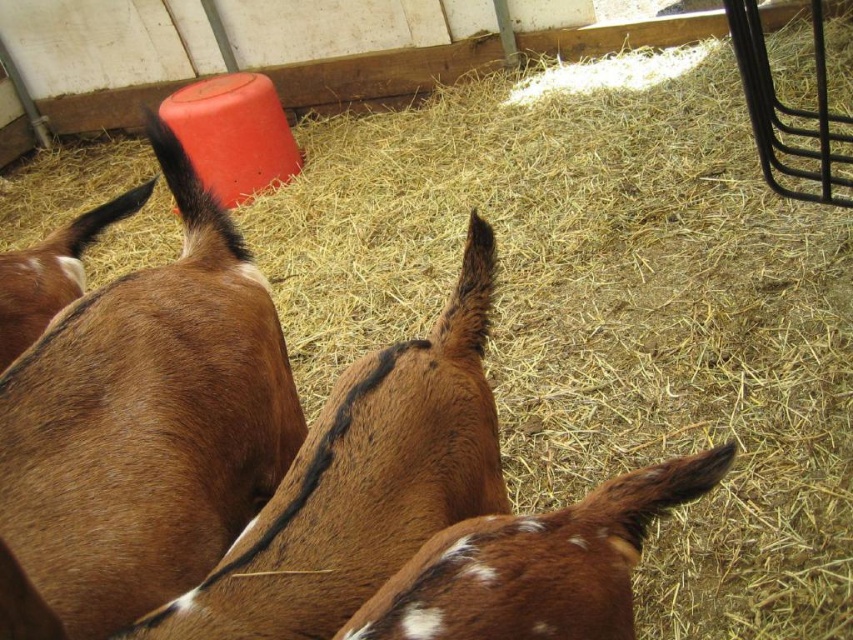
Question: Which point appears farthest from the camera in this image?

Choices:
 (A) (0, 456)
 (B) (25, 289)
 (C) (601, 484)

Answer: (B)

Question: Does brown speckled fur at center have a larger size compared to brown furry goat at upper left?

Choices:
 (A) yes
 (B) no

Answer: (B)

Question: Estimate the real-world distances between objects in this image. Which object is closer to the brown furry goat at center?

Choices:
 (A) brown speckled fur at center
 (B) brown furry goat at upper left

Answer: (A)

Question: Can you confirm if brown furry goat at center is positioned to the left of brown furry goat at upper left?

Choices:
 (A) yes
 (B) no

Answer: (B)

Question: Is the position of brown fuzzy goat at upper left more distant than that of brown speckled fur at center?

Choices:
 (A) no
 (B) yes

Answer: (B)

Question: Among these objects, which one is nearest to the camera?

Choices:
 (A) brown speckled fur at center
 (B) brown furry goat at upper left
 (C) brown fuzzy goat at upper left
 (D) brown furry goat at center

Answer: (A)